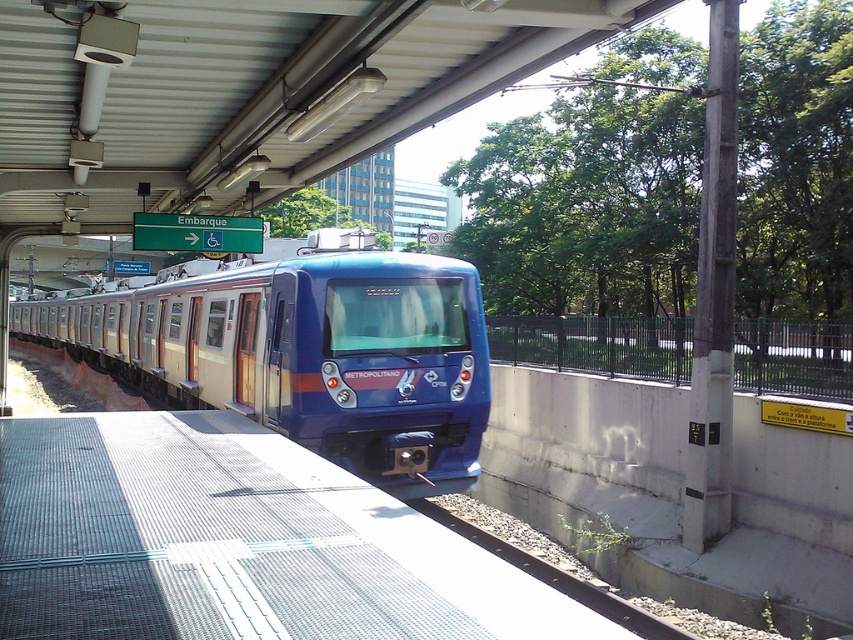
Who is more distant from viewer, (173, 330) or (451, 524)?

Point (173, 330)

Does blue metallic train at center appear over rusty metal train track at lower center?

Correct, blue metallic train at center is located above rusty metal train track at lower center.

Is point (267, 426) closer to viewer compared to point (505, 545)?

No, (267, 426) is behind (505, 545).

The height and width of the screenshot is (640, 853). Identify the location of blue metallic train at center. (305, 349).